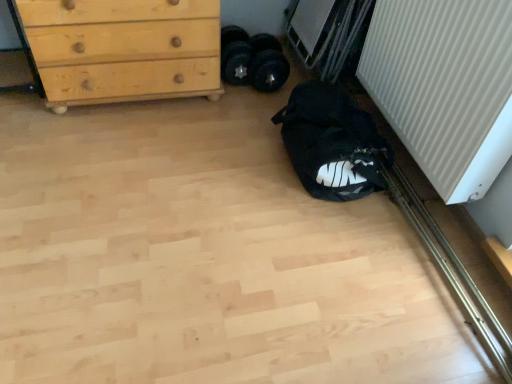
This screenshot has height=384, width=512. Describe the element at coordinates (445, 87) in the screenshot. I see `white ribbed radiator at right` at that location.

Where is `black fabric bag at lower right`? black fabric bag at lower right is located at coordinates (331, 143).

I want to click on white ribbed radiator at right, so click(445, 87).

Who is taller, light wood/texture chest of drawers at upper left or white ribbed radiator at right?

With more height is white ribbed radiator at right.

You are a GUI agent. You are given a task and a screenshot of the screen. Output one action in this format:
    pyautogui.click(x=<x>, y=<y>)
    Task: Click on the radiator in front of the light wood/texture chest of drawers at upper left
    
    Given the screenshot: What is the action you would take?
    pyautogui.click(x=445, y=87)

Is light wood/texture chest of drawers at upper left completely or partially outside of white ribbed radiator at right?

Yes, light wood/texture chest of drawers at upper left is not within white ribbed radiator at right.

From a real-world perspective, which is physically above, light wood/texture chest of drawers at upper left or white ribbed radiator at right?

white ribbed radiator at right, from a real-world perspective.

Is black fabric bag at lower right to the left or to the right of white ribbed radiator at right in the image?

black fabric bag at lower right is to the left of white ribbed radiator at right.

Do you think black fabric bag at lower right is within white ribbed radiator at right, or outside of it?

black fabric bag at lower right is located beyond the bounds of white ribbed radiator at right.

Which object is wider, black fabric bag at lower right or white ribbed radiator at right?

black fabric bag at lower right.

This screenshot has height=384, width=512. In order to click on the chest of drawers that is above the black fabric bag at lower right (from a real-world perspective) in this screenshot , I will do `click(123, 49)`.

From the image's perspective, is light wood/texture chest of drawers at upper left beneath black fabric bag at lower right?

No, from the image's perspective, light wood/texture chest of drawers at upper left is not below black fabric bag at lower right.

From a real-world perspective, which object stands above the other?

light wood/texture chest of drawers at upper left is physically above.

From the picture: Which is closer to the camera, (73, 92) or (353, 113)?

Point (73, 92).

Which of these two, black fabric bag at lower right or light wood/texture chest of drawers at upper left, stands shorter?

black fabric bag at lower right is shorter.

Can you tell me how much black fabric bag at lower right and light wood/texture chest of drawers at upper left differ in facing direction?

The angular difference between black fabric bag at lower right and light wood/texture chest of drawers at upper left is 0.00038 degrees.

Does black fabric bag at lower right have a larger size compared to light wood/texture chest of drawers at upper left?

Actually, black fabric bag at lower right might be smaller than light wood/texture chest of drawers at upper left.

Considering the positions of objects black fabric bag at lower right and light wood/texture chest of drawers at upper left in the image provided, who is behind, black fabric bag at lower right or light wood/texture chest of drawers at upper left?

light wood/texture chest of drawers at upper left is behind.

From a real-world perspective, which object rests below the other?

black fabric bag at lower right, from a real-world perspective.

Is white ribbed radiator at right to the left of black fabric bag at lower right from the viewer's perspective?

Incorrect, white ribbed radiator at right is not on the left side of black fabric bag at lower right.

Which is correct: white ribbed radiator at right is inside black fabric bag at lower right, or outside of it?

white ribbed radiator at right is spatially situated outside black fabric bag at lower right.

What's the angular difference between white ribbed radiator at right and light wood/texture chest of drawers at upper left's facing directions?

The angle between the facing direction of white ribbed radiator at right and the facing direction of light wood/texture chest of drawers at upper left is 90 degrees.

In the image, is white ribbed radiator at right on the left side or the right side of light wood/texture chest of drawers at upper left?

From the image, it's evident that white ribbed radiator at right is to the right of light wood/texture chest of drawers at upper left.

From their relative heights in the image, would you say white ribbed radiator at right is taller or shorter than light wood/texture chest of drawers at upper left?

Considering their sizes, white ribbed radiator at right has more height than light wood/texture chest of drawers at upper left.

Who is smaller, white ribbed radiator at right or light wood/texture chest of drawers at upper left?

With smaller size is white ribbed radiator at right.

Locate an element on the screen. Image resolution: width=512 pixels, height=384 pixels. radiator that is in front of the light wood/texture chest of drawers at upper left is located at coordinates (445, 87).

The width and height of the screenshot is (512, 384). In order to click on radiator that is above the black fabric bag at lower right (from the image's perspective) in this screenshot , I will do `click(445, 87)`.

Considering their positions, is white ribbed radiator at right positioned closer to light wood/texture chest of drawers at upper left than black fabric bag at lower right?

black fabric bag at lower right lies closer to light wood/texture chest of drawers at upper left than the other object.

Which object lies nearer to the anchor point white ribbed radiator at right, black fabric bag at lower right or light wood/texture chest of drawers at upper left?

black fabric bag at lower right is closer to white ribbed radiator at right.

Estimate the real-world distances between objects in this image. Which object is further from light wood/texture chest of drawers at upper left, black fabric bag at lower right or white ribbed radiator at right?

Based on the image, white ribbed radiator at right appears to be further to light wood/texture chest of drawers at upper left.

Considering their positions, is light wood/texture chest of drawers at upper left positioned further to white ribbed radiator at right than black fabric bag at lower right?

light wood/texture chest of drawers at upper left is positioned further to the anchor white ribbed radiator at right.

From the image, which object appears to be farther from black fabric bag at lower right, white ribbed radiator at right or light wood/texture chest of drawers at upper left?

light wood/texture chest of drawers at upper left.

Looking at the image, which one is located further to black fabric bag at lower right, light wood/texture chest of drawers at upper left or white ribbed radiator at right?

The object further to black fabric bag at lower right is light wood/texture chest of drawers at upper left.

You are a GUI agent. You are given a task and a screenshot of the screen. Output one action in this format:
    pyautogui.click(x=<x>, y=<y>)
    Task: Click on the sleeping bag between light wood/texture chest of drawers at upper left and white ribbed radiator at right from left to right
    
    Given the screenshot: What is the action you would take?
    pyautogui.click(x=331, y=143)